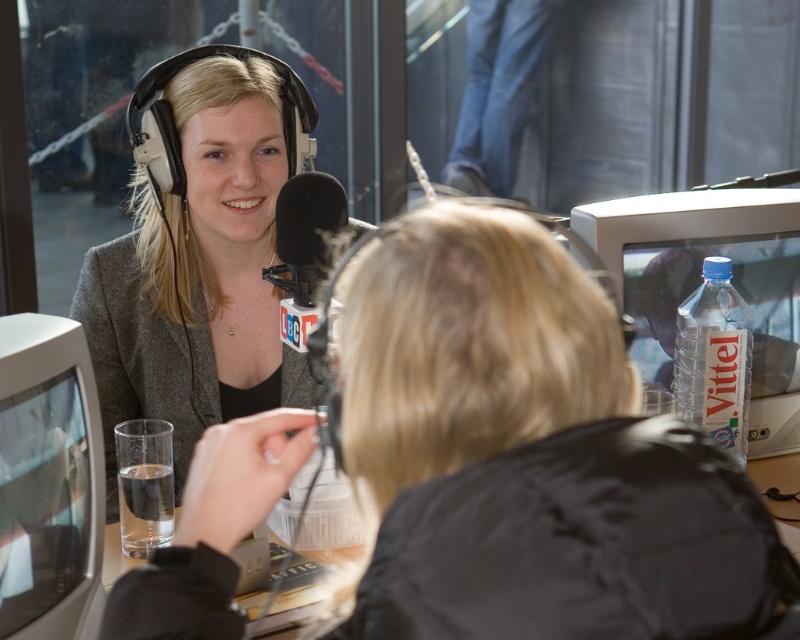
Question: Can you confirm if white glossy computer monitor at left is positioned above black matte microphone at center?

Choices:
 (A) yes
 (B) no

Answer: (B)

Question: Considering the real-world distances, which object is farthest from the white glossy computer monitor at left?

Choices:
 (A) black matte microphone at center
 (B) matte gray blazer at center
 (C) clear plastic monitor at upper right

Answer: (C)

Question: Is white glossy computer monitor at left in front of black matte microphone at center?

Choices:
 (A) yes
 (B) no

Answer: (A)

Question: Estimate the real-world distances between objects in this image. Which object is closer to the matte gray blazer at center?

Choices:
 (A) clear plastic monitor at upper right
 (B) black matte microphone at center
 (C) white glossy computer monitor at left

Answer: (C)

Question: Is matte gray blazer at center above black matte microphone at center?

Choices:
 (A) no
 (B) yes

Answer: (A)

Question: Which of the following is the closest to the observer?

Choices:
 (A) (62, 349)
 (B) (188, 243)
 (C) (308, 264)
 (D) (601, 236)

Answer: (C)